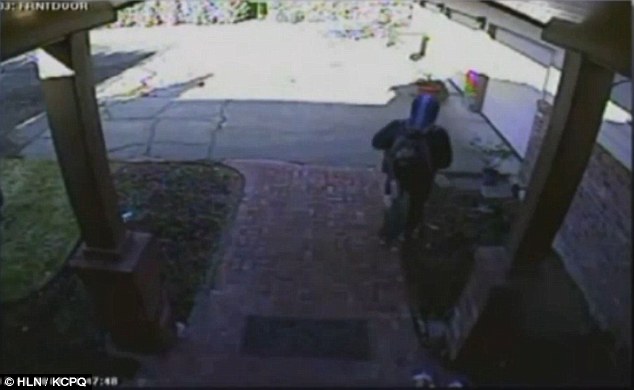
At what (x,y) coordinates should I click in order to perform the action: click on door mat. Please return your answer as a coordinate pair (x, y). Looking at the image, I should click on (306, 337).